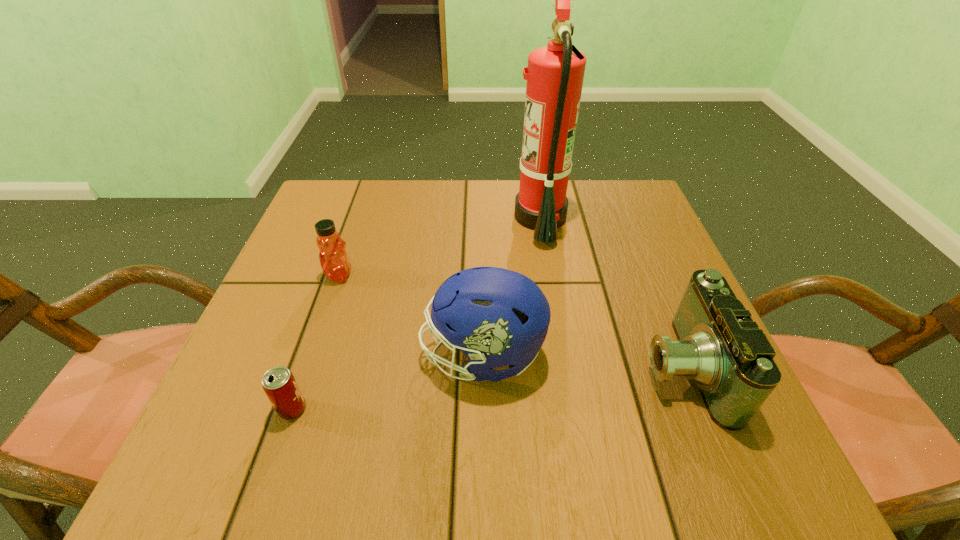
Where is `fire extinguisher`? fire extinguisher is located at coordinates (555, 73).

The image size is (960, 540). In order to click on the farthest object in this screenshot , I will do `click(555, 73)`.

I want to click on the fourth shortest object, so click(497, 317).

Where is `the rightmost object`? This screenshot has height=540, width=960. the rightmost object is located at coordinates (719, 347).

Locate an element on the screen. This screenshot has height=540, width=960. honey is located at coordinates (333, 257).

At what (x,y) coordinates should I click in order to perform the action: click on beer can. Please return your answer as a coordinate pair (x, y). Looking at the image, I should click on (279, 384).

Where is `free space located at the nozzle of the farthest object`? free space located at the nozzle of the farthest object is located at coordinates (431, 218).

Where is `vacant space located at the nozzle of the farthest object`? The height and width of the screenshot is (540, 960). vacant space located at the nozzle of the farthest object is located at coordinates (387, 218).

I want to click on vacant space situated at the nozzle of the farthest object, so click(x=487, y=218).

At what (x,y) coordinates should I click in order to perform the action: click on free space located 0.050m on the face guard of the fourth shortest object. Please return your answer as a coordinate pair (x, y). Image resolution: width=960 pixels, height=540 pixels. Looking at the image, I should click on (394, 355).